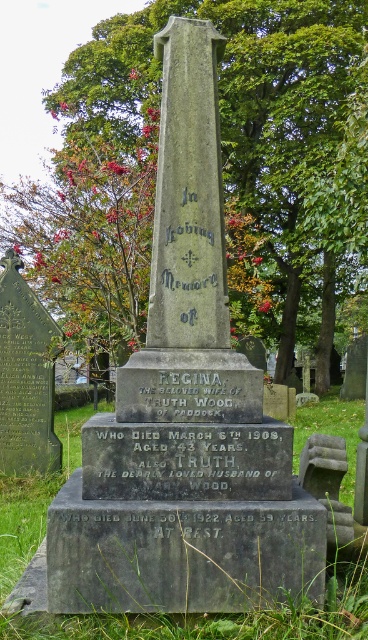
Question: Is green leafy tree at center wider than green grass at center?

Choices:
 (A) yes
 (B) no

Answer: (A)

Question: Does green leafy tree at center lie in front of green grass at center?

Choices:
 (A) yes
 (B) no

Answer: (B)

Question: Can you confirm if green leafy tree at center is wider than green grass at center?

Choices:
 (A) no
 (B) yes

Answer: (B)